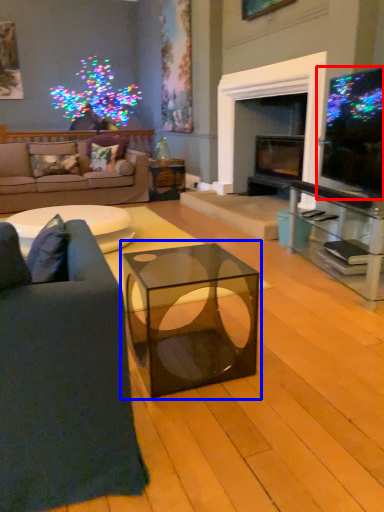
Question: Which object appears closest to the camera in this image, television (highlighted by a red box) or coffee table (highlighted by a blue box)?

Choices:
 (A) television
 (B) coffee table

Answer: (B)